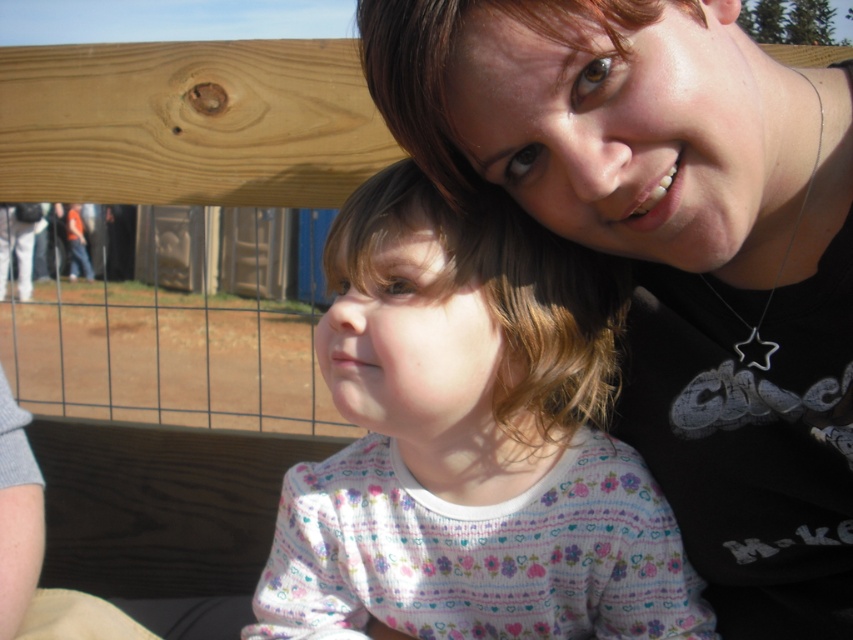
Who is shorter, matte black shirt at upper right or floral-patterned sweater at center?

floral-patterned sweater at center is shorter.

Can you confirm if matte black shirt at upper right is positioned below floral-patterned sweater at center?

Incorrect, matte black shirt at upper right is not positioned below floral-patterned sweater at center.

Describe the element at coordinates (674, 252) in the screenshot. I see `matte black shirt at upper right` at that location.

The image size is (853, 640). In order to click on matte black shirt at upper right in this screenshot , I will do `click(674, 252)`.